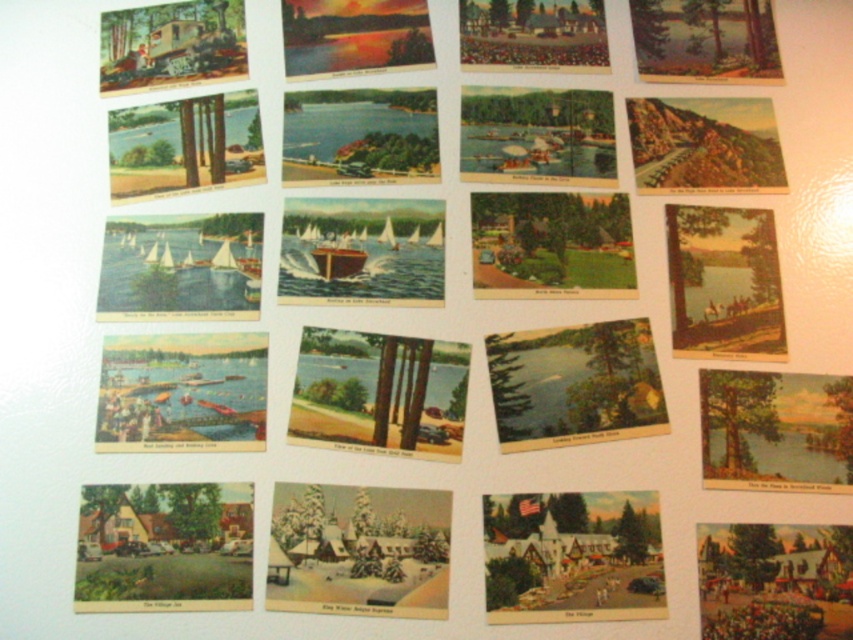
In the scene shown: Is snow-covered trees at center wider than matte paper boat at center?

Indeed, snow-covered trees at center has a greater width compared to matte paper boat at center.

Does point (276, 508) come in front of point (247, 376)?

Yes, point (276, 508) is in front of point (247, 376).

Locate an element on the screen. snow-covered trees at center is located at coordinates (358, 550).

Is the position of wooden boat at center more distant than that of matte orange sky at upper center?

No.

Is point (424, 209) closer to viewer compared to point (293, 1)?

Yes, point (424, 209) is in front of point (293, 1).

This screenshot has height=640, width=853. Describe the element at coordinates (361, 252) in the screenshot. I see `wooden boat at center` at that location.

This screenshot has height=640, width=853. I want to click on wooden boat at center, so click(x=361, y=252).

Can you confirm if matte brown tree at upper right is positioned to the left of matte orange sky at upper center?

No, matte brown tree at upper right is not to the left of matte orange sky at upper center.

Which of these two, matte brown tree at upper right or matte orange sky at upper center, stands taller?

With more height is matte brown tree at upper right.

Which is in front, point (728, 16) or point (286, 12)?

Positioned in front is point (286, 12).

This screenshot has height=640, width=853. In order to click on matte brown tree at upper right in this screenshot , I will do `click(705, 40)`.